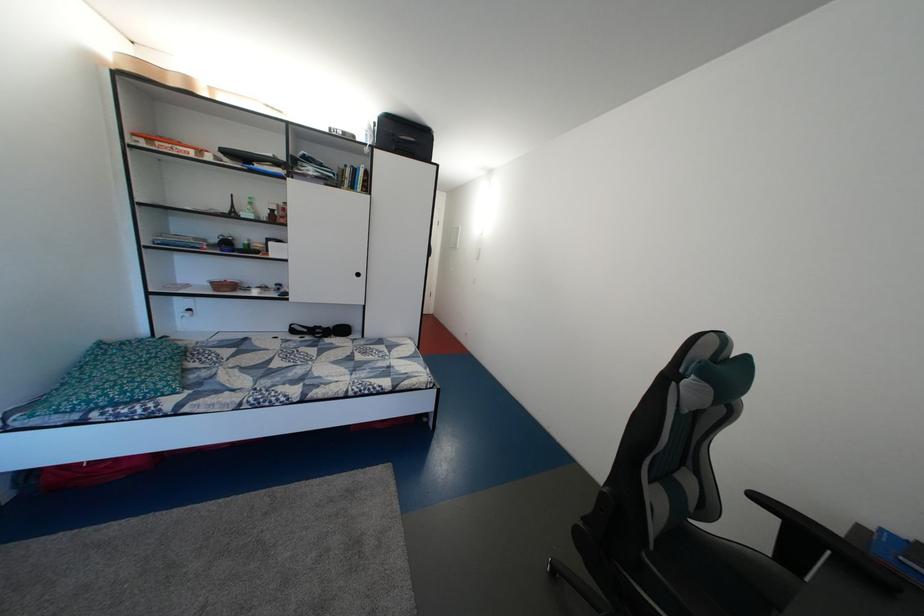
The width and height of the screenshot is (924, 616). Describe the element at coordinates (809, 527) in the screenshot. I see `the chair armrest` at that location.